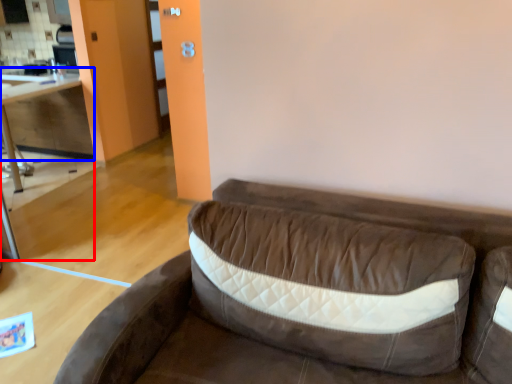
Question: Among these objects, which one is nearest to the camera, table (highlighted by a red box) or cabinetry (highlighted by a blue box)?

Choices:
 (A) table
 (B) cabinetry

Answer: (A)